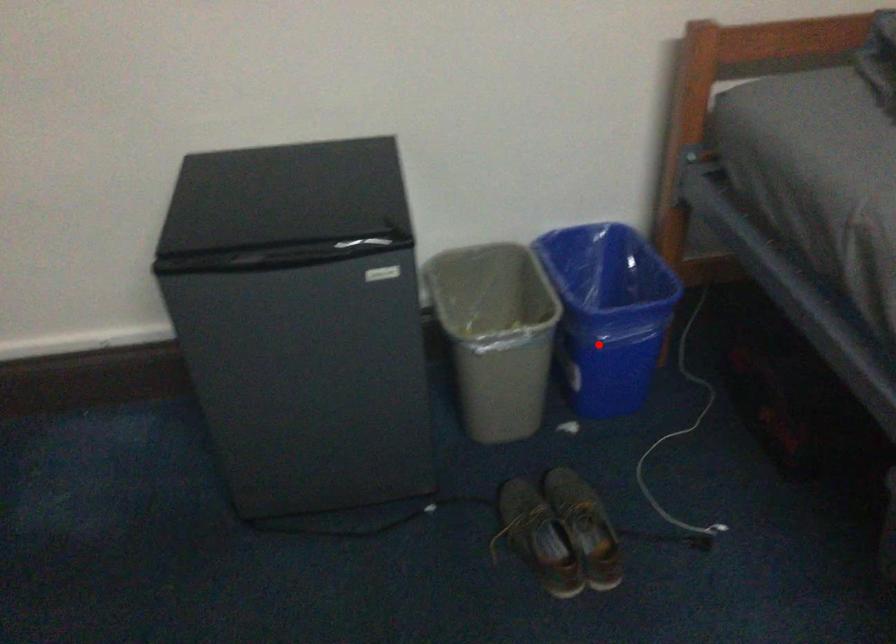
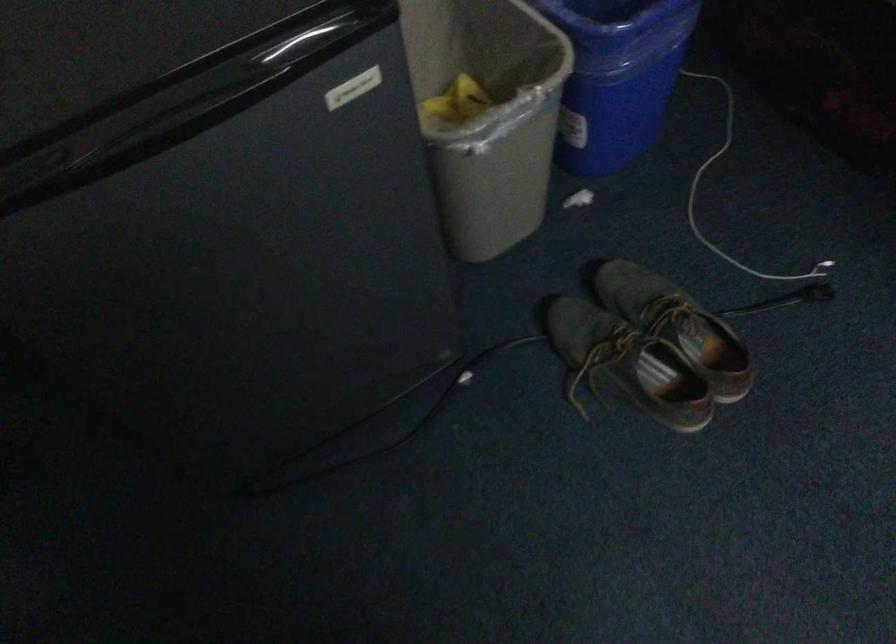
Where in the second image is the point corresponding to the highlighted location from the first image?

(616, 76)